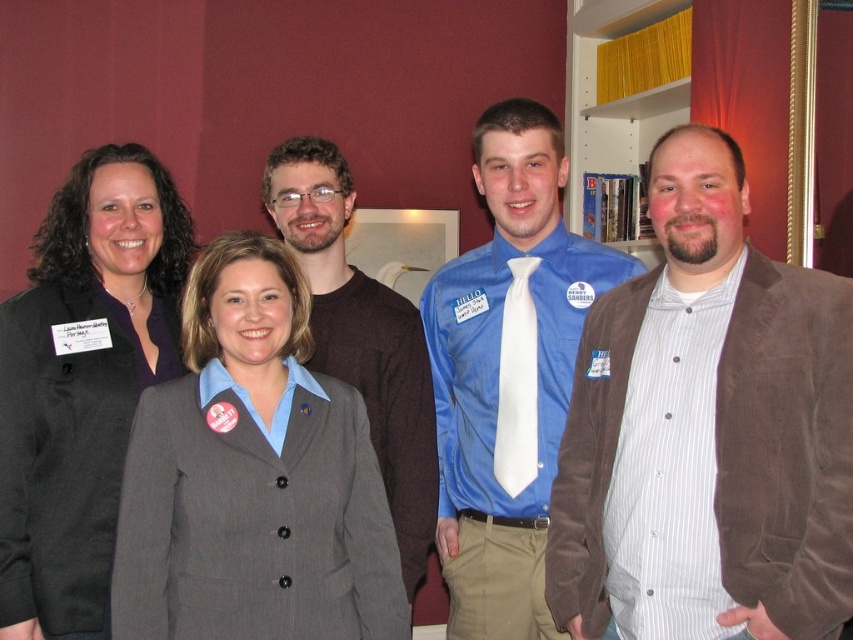
Question: Is blue cotton shirt at center positioned behind yellow paper at upper right?

Choices:
 (A) yes
 (B) no

Answer: (B)

Question: Is matte black blazer at left below white silk tie at center?

Choices:
 (A) yes
 (B) no

Answer: (A)

Question: Which of these objects is positioned closest to the brown corduroy blazer at right?

Choices:
 (A) yellow paper at upper right
 (B) white silk tie at center
 (C) gray wool suit at center

Answer: (B)

Question: Is matte black blazer at left positioned in front of yellow paper at upper right?

Choices:
 (A) no
 (B) yes

Answer: (B)

Question: Which object is the closest to the blue cotton shirt at center?

Choices:
 (A) yellow paper at upper right
 (B) white silk tie at center

Answer: (B)

Question: Which point is closer to the camera?

Choices:
 (A) (511, 460)
 (B) (154, 401)

Answer: (B)